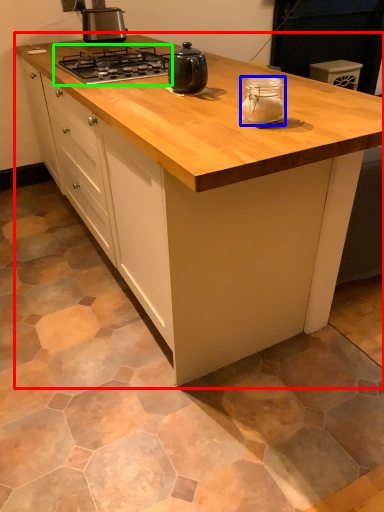
Question: Which object is positioned farthest from cabinetry (highlighted by a red box)? Select from kitchen appliance (highlighted by a blue box) and gas stove (highlighted by a green box).

Choices:
 (A) kitchen appliance
 (B) gas stove

Answer: (B)